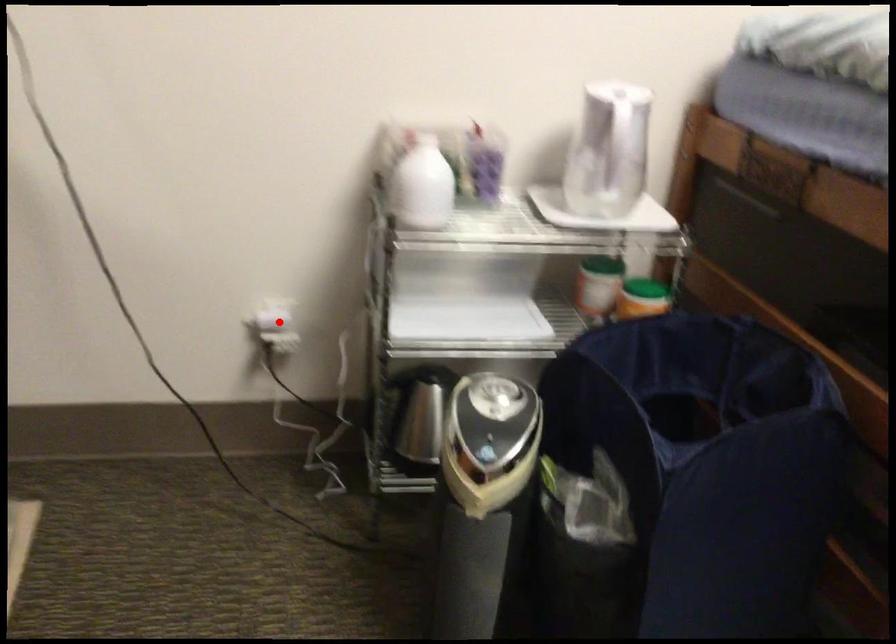
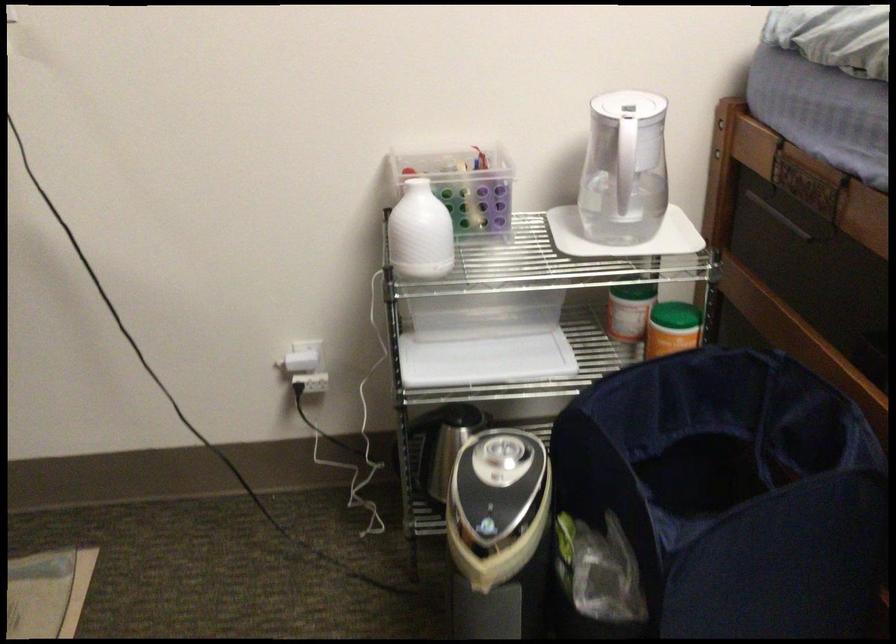
Locate, in the second image, the point that corresponds to the highlighted location in the first image.

(306, 366)